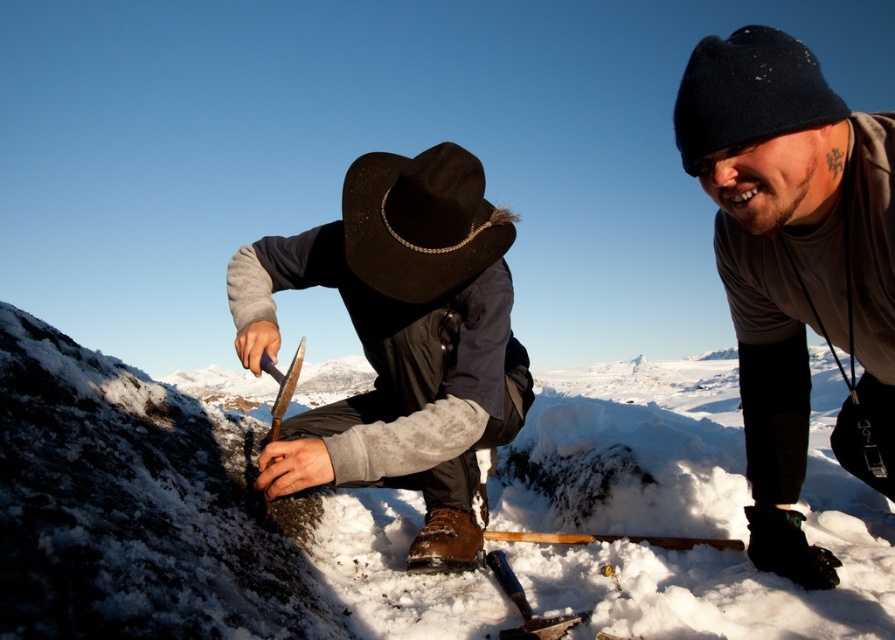
Can you confirm if dark gray knit hat at upper right is positioned to the left of black felt cowboy hat at upper center?

No, dark gray knit hat at upper right is not to the left of black felt cowboy hat at upper center.

What do you see at coordinates (795, 266) in the screenshot?
I see `dark gray knit hat at upper right` at bounding box center [795, 266].

Locate an element on the screen. This screenshot has height=640, width=895. dark gray knit hat at upper right is located at coordinates (795, 266).

You are a GUI agent. You are given a task and a screenshot of the screen. Output one action in this format:
    pyautogui.click(x=<x>, y=<y>)
    Task: Click on the dark gray knit hat at upper right
    The height and width of the screenshot is (640, 895).
    Given the screenshot: What is the action you would take?
    pyautogui.click(x=795, y=266)

Which of these two, white fluffy snow at center or dark gray knit hat at upper right, stands taller?

white fluffy snow at center is taller.

The height and width of the screenshot is (640, 895). Identify the location of white fluffy snow at center. (186, 518).

Between point (534, 518) and point (752, 60), which one is positioned behind?

The point (534, 518) is behind.

The width and height of the screenshot is (895, 640). I want to click on white fluffy snow at center, so click(186, 518).

Which is below, white fluffy snow at center or black felt cowboy hat at upper center?

Positioned lower is white fluffy snow at center.

Can you confirm if white fluffy snow at center is thinner than black felt cowboy hat at upper center?

No.

Locate an element on the screen. white fluffy snow at center is located at coordinates (x=186, y=518).